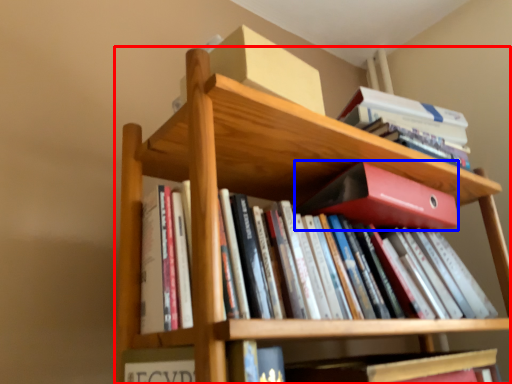
Question: Which of the following is the farthest to the observer, bookcase (highlighted by a red box) or paperback book (highlighted by a blue box)?

Choices:
 (A) bookcase
 (B) paperback book

Answer: (B)